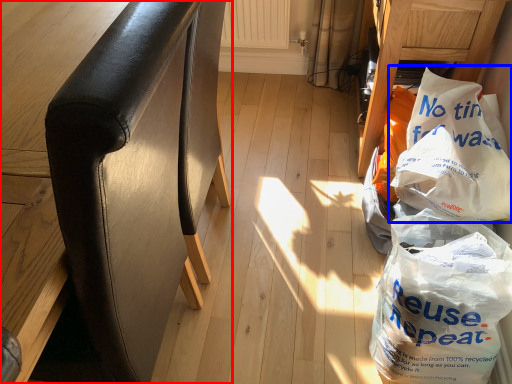
Question: Among these objects, which one is farthest to the camera, furniture (highlighted by a red box) or plastic bag (highlighted by a blue box)?

Choices:
 (A) furniture
 (B) plastic bag

Answer: (B)